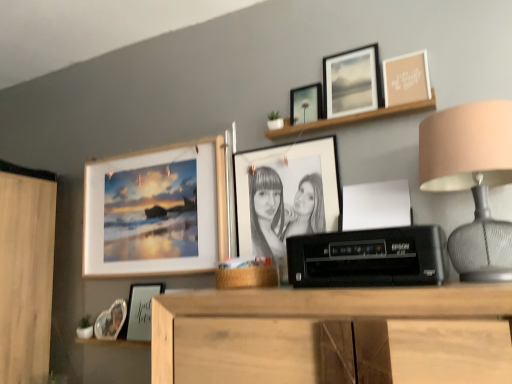
Question: From a real-world perspective, is white matte frame at lower center, acting as the 2th shelf starting from the right, physically below matte black picture frame at upper center, which appears as the third picture frame when viewed from the right?

Choices:
 (A) no
 (B) yes

Answer: (B)

Question: Is white matte frame at lower center, marked as the second shelf in a front-to-back arrangement, next to matte black picture frame at upper center, which appears as the third picture frame when viewed from the right?

Choices:
 (A) yes
 (B) no

Answer: (B)

Question: Is matte black picture frame at upper center, which appears as the third picture frame when viewed from the right, at the back of white matte frame at lower center, which is the first shelf from left to right?

Choices:
 (A) yes
 (B) no

Answer: (B)

Question: From a real-world perspective, is white matte frame at lower center, marked as the second shelf in a front-to-back arrangement, physically above matte black picture frame at upper center, the fifth picture frame in the left-to-right sequence?

Choices:
 (A) no
 (B) yes

Answer: (A)

Question: Is white matte frame at lower center, which is the first shelf in bottom-to-top order, shorter than matte black picture frame at upper center, the fifth picture frame in the left-to-right sequence?

Choices:
 (A) yes
 (B) no

Answer: (A)

Question: Is white matte frame at lower center, marked as the second shelf in a front-to-back arrangement, outside matte black picture frame at upper center, which appears as the third picture frame when viewed from the right?

Choices:
 (A) no
 (B) yes

Answer: (B)

Question: Can you confirm if black plastic printer at center is bigger than matte black photo frame at center, positioned as the fourth picture frame in left-to-right order?

Choices:
 (A) yes
 (B) no

Answer: (A)

Question: Is black plastic printer at center positioned before matte black photo frame at center, which is counted as the fourth picture frame, starting from the right?

Choices:
 (A) no
 (B) yes

Answer: (B)

Question: Can you confirm if black plastic printer at center is thinner than matte black photo frame at center, which is counted as the fourth picture frame, starting from the right?

Choices:
 (A) yes
 (B) no

Answer: (B)

Question: Is black plastic printer at center taller than matte black photo frame at center, which is counted as the fourth picture frame, starting from the right?

Choices:
 (A) yes
 (B) no

Answer: (B)

Question: Would you say black plastic printer at center is outside matte black photo frame at center, which is counted as the fourth picture frame, starting from the right?

Choices:
 (A) no
 (B) yes

Answer: (B)

Question: Can matte black photo frame at center, which is counted as the fourth picture frame, starting from the right, be found inside black plastic printer at center?

Choices:
 (A) yes
 (B) no

Answer: (B)

Question: Can you confirm if matte black photo frame at center, which is counted as the fourth picture frame, starting from the right, is bigger than clear glass photo frame at lower left, the first picture frame in the left-to-right sequence?

Choices:
 (A) no
 (B) yes

Answer: (B)